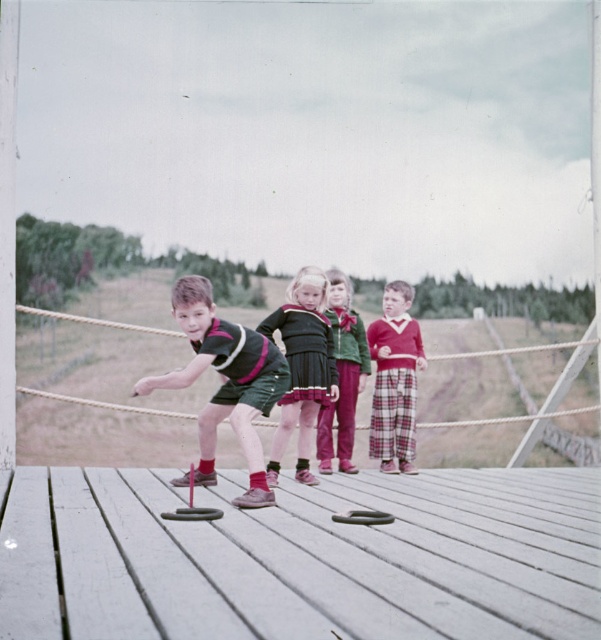
Between point (305, 310) and point (412, 472), which one is positioned in front?

Point (305, 310) is more forward.

Does matte black dress at center have a smaller size compared to plaid fabric pants at center?

Actually, matte black dress at center might be larger than plaid fabric pants at center.

Is point (337, 376) farther from viewer compared to point (385, 332)?

No.

Image resolution: width=601 pixels, height=640 pixels. Identify the location of matte black dress at center. (302, 365).

The image size is (601, 640). What do you see at coordinates (224, 381) in the screenshot? I see `matte green shorts at center` at bounding box center [224, 381].

Which is above, matte green shorts at center or plaid fabric pants at center?

plaid fabric pants at center is higher up.

Locate an element on the screen. This screenshot has height=640, width=601. matte green shorts at center is located at coordinates (224, 381).

Who is more distant from viewer, (186, 291) or (332, 312)?

Point (332, 312)

Is matte green shorts at center to the left of velvet green sweater at center from the viewer's perspective?

Yes, matte green shorts at center is to the left of velvet green sweater at center.

Who is more distant from viewer, (200,337) or (338,397)?

Positioned behind is point (338,397).

Where is `matte green shorts at center`? This screenshot has width=601, height=640. matte green shorts at center is located at coordinates 224,381.